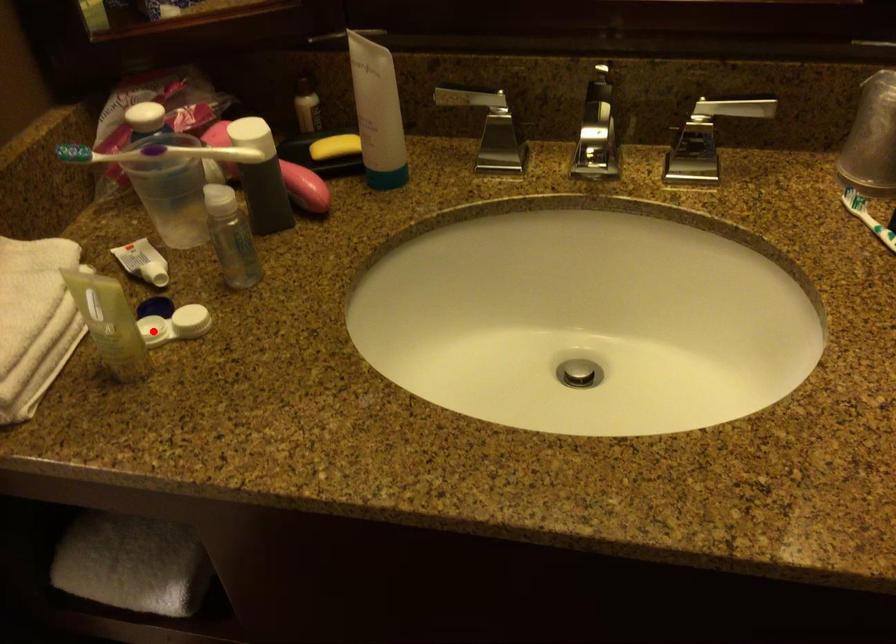
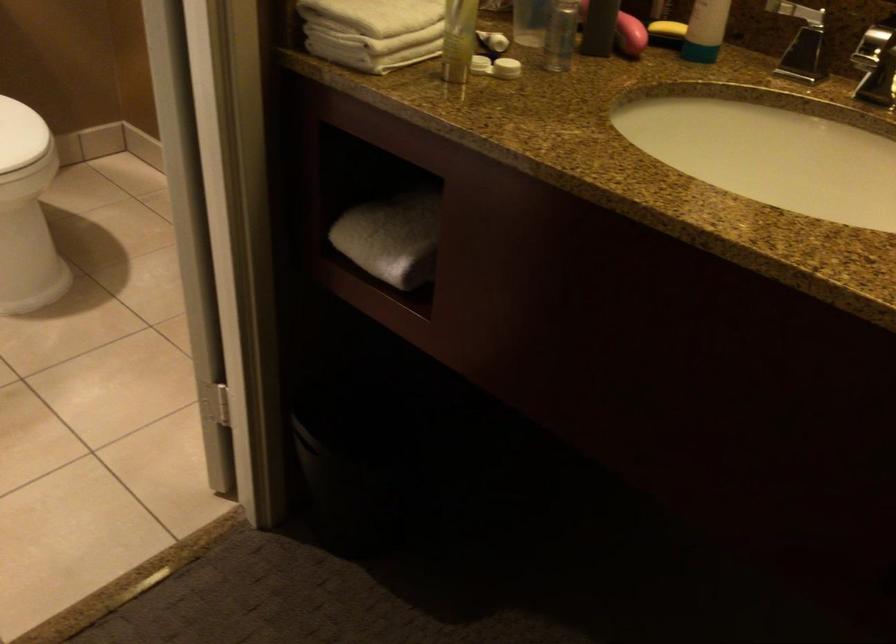
Question: A red point is marked in image1. In image2, is the corresponding 3D point closer to the camera or farther? Reply with the corresponding letter.

Choices:
 (A) The corresponding 3D point is closer.
 (B) The corresponding 3D point is farther.

Answer: (B)